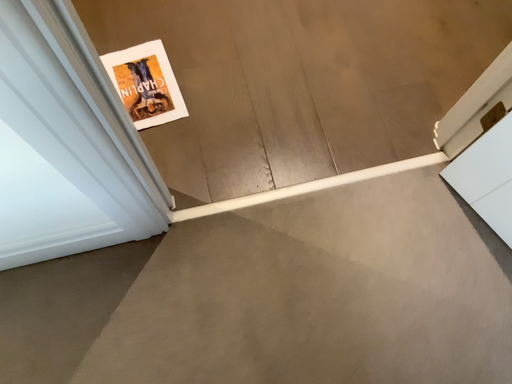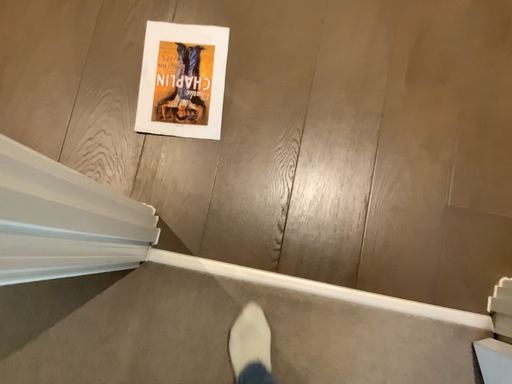
Question: Which way did the camera rotate in the video?

Choices:
 (A) rotated left
 (B) rotated right

Answer: (A)